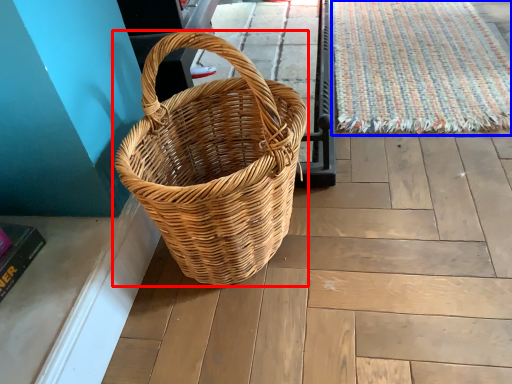
Question: Which object is further to the camera taking this photo, picnic basket (highlighted by a red box) or doormat (highlighted by a blue box)?

Choices:
 (A) picnic basket
 (B) doormat

Answer: (B)